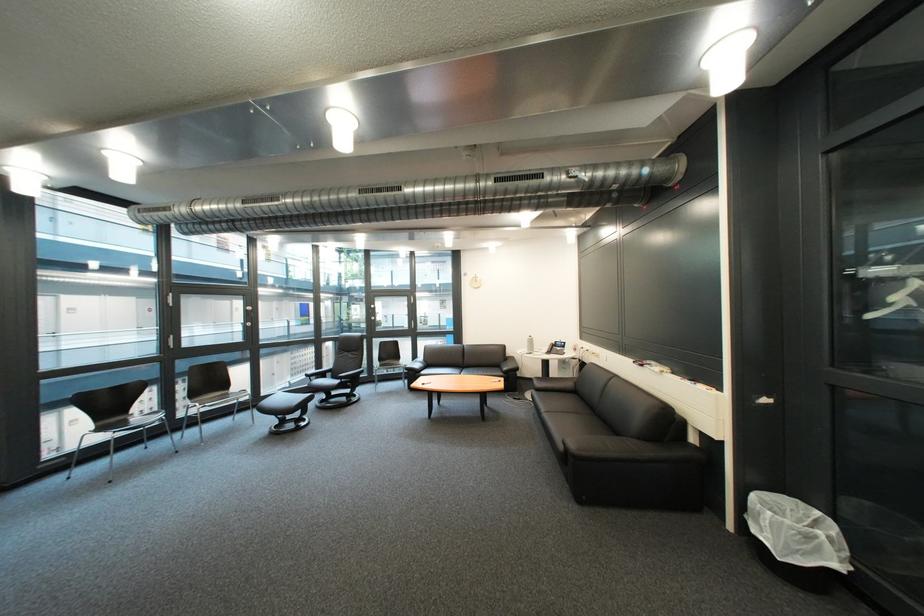
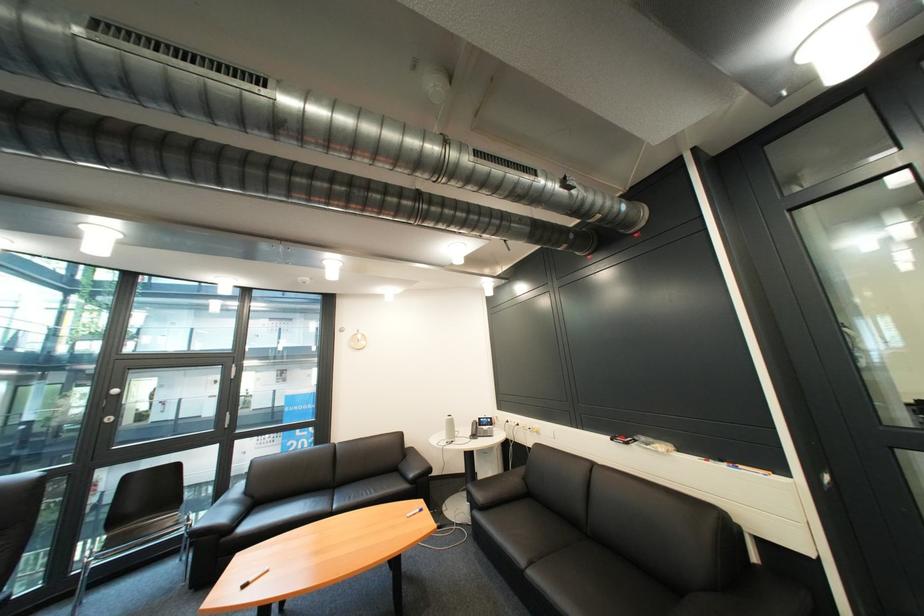
Locate, in the second image, the point that corresponds to (x=569, y=344) in the first image.

(492, 419)